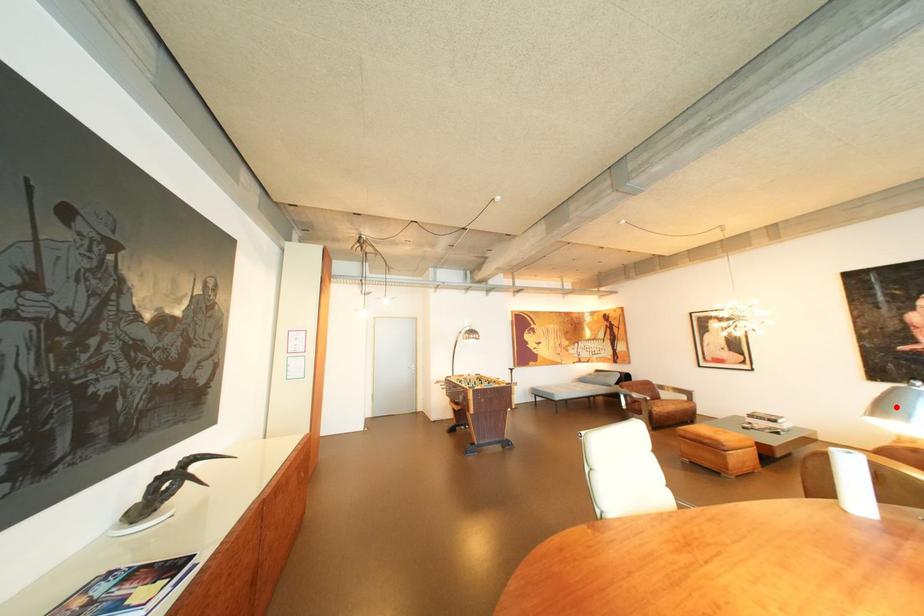
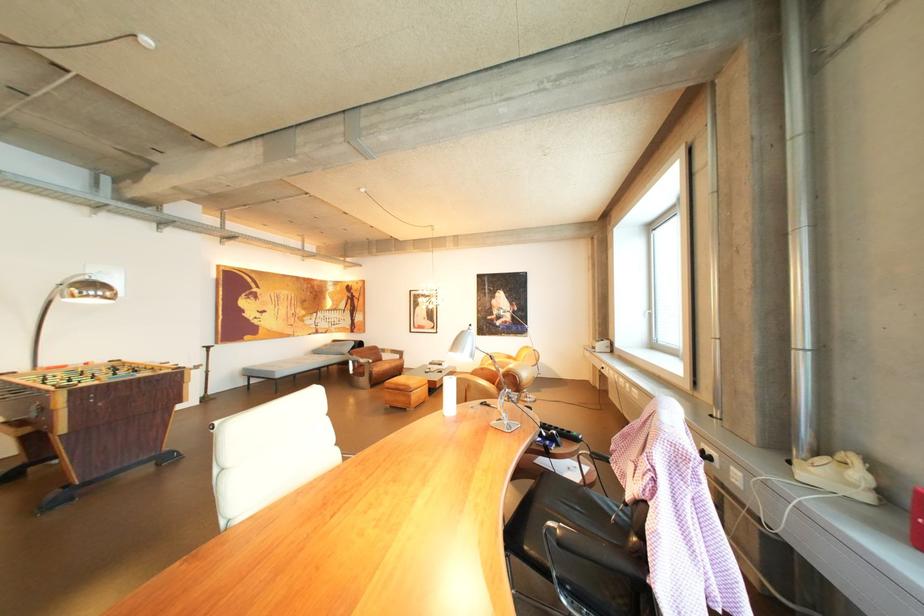
The point at the highlighted location is marked in the first image. Where is the corresponding point in the second image?

(469, 345)